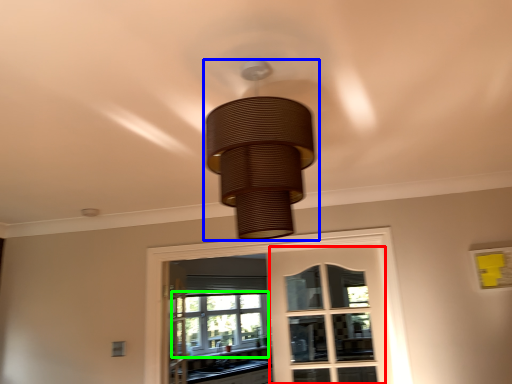
Question: Which object is positioned farthest from screen door (highlighted by a red box)? Select from lamp (highlighted by a blue box) and bay window (highlighted by a green box).

Choices:
 (A) lamp
 (B) bay window

Answer: (A)